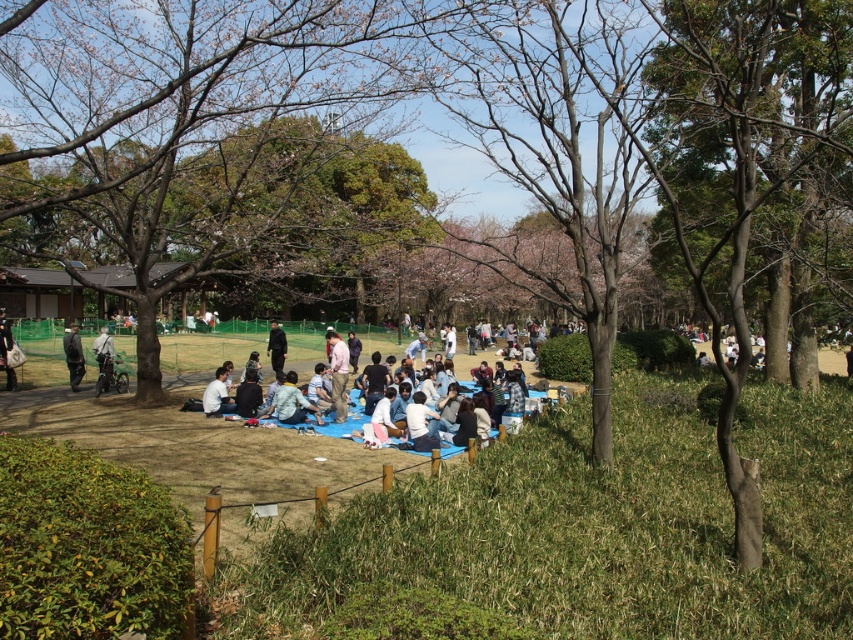
Question: Can you confirm if green bark tree at center is thinner than light brown fabric shirt at center?

Choices:
 (A) no
 (B) yes

Answer: (A)

Question: Which point is closer to the camera?

Choices:
 (A) (335, 397)
 (B) (381, 547)
 (C) (285, 352)
 (D) (80, 353)

Answer: (B)

Question: Among these points, which one is farthest from the camera?

Choices:
 (A) (175, 220)
 (B) (332, 387)
 (C) (265, 348)

Answer: (C)

Question: Is light brown fabric shirt at center further to the viewer compared to light gray fabric bag at center?

Choices:
 (A) no
 (B) yes

Answer: (A)

Question: Does light gray fabric bag at center come in front of dark blue suit at center?

Choices:
 (A) no
 (B) yes

Answer: (B)

Question: Which of the following is the closest to the observer?

Choices:
 (A) [76, 365]
 (B) [282, 356]
 (C) [299, 401]

Answer: (C)